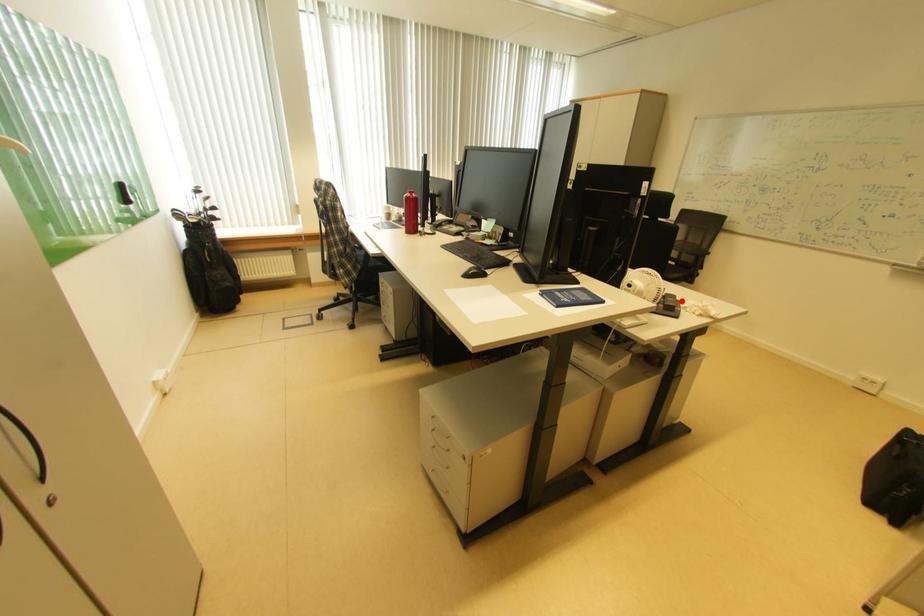
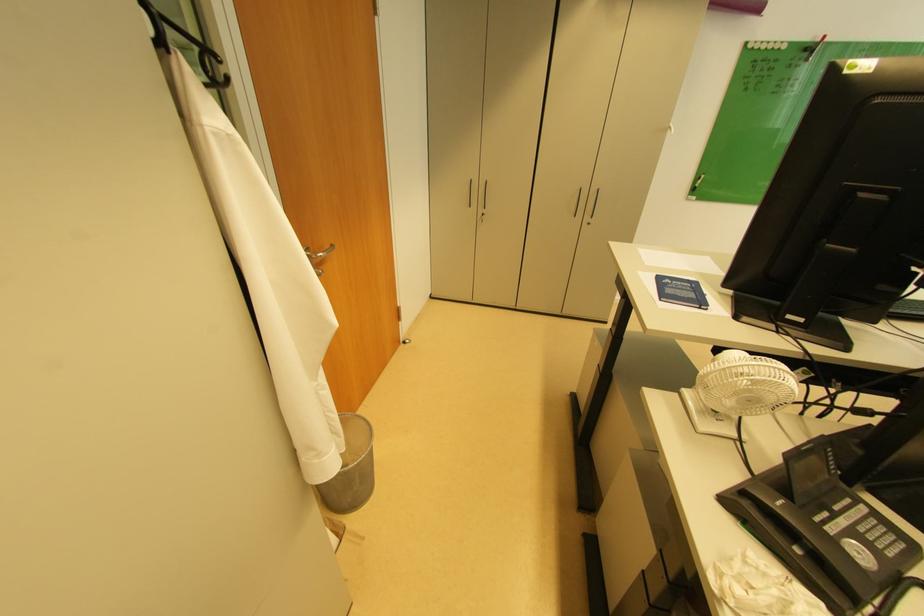
Question: I am providing you with two images of the same scene from different viewpoints. Given a red point in image1, look at the same physical point in image2. Is it:

Choices:
 (A) Closer to the viewpoint
 (B) Farther from the viewpoint

Answer: (A)